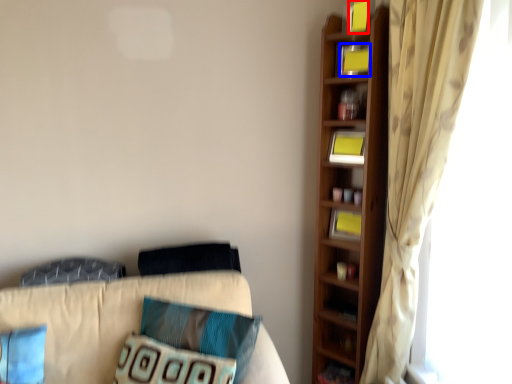
Question: Among these objects, which one is nearest to the camera, book (highlighted by a red box) or book (highlighted by a blue box)?

Choices:
 (A) book
 (B) book

Answer: (A)